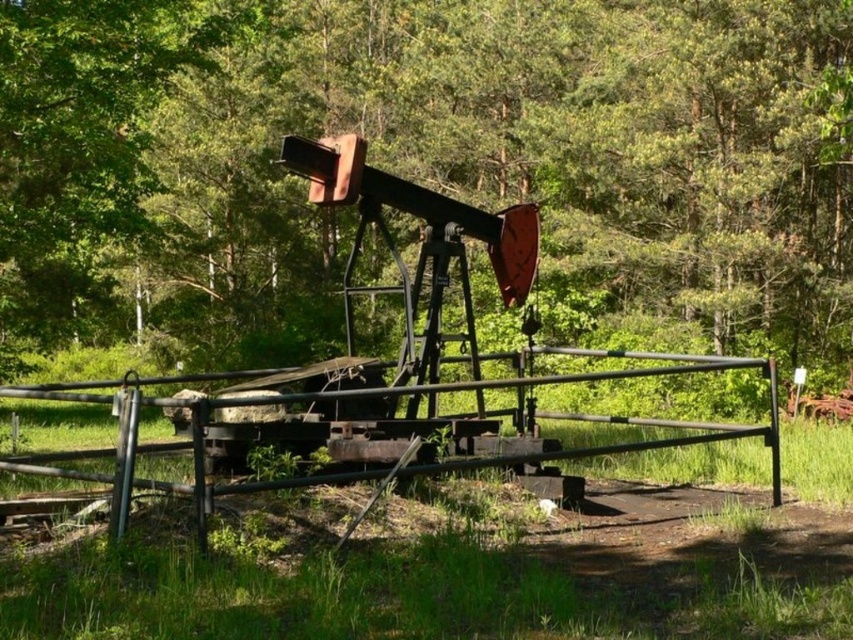
Question: From the image, what is the correct spatial relationship of green leafy tree at center in relation to rusty metal fence at center?

Choices:
 (A) left
 (B) right

Answer: (A)

Question: Does green leafy tree at center appear under rusty metal fence at center?

Choices:
 (A) no
 (B) yes

Answer: (A)

Question: Which object is farther from the camera taking this photo?

Choices:
 (A) green leafy tree at center
 (B) rusty metal fence at center

Answer: (A)

Question: Does green leafy tree at center appear on the left side of rusty metal fence at center?

Choices:
 (A) no
 (B) yes

Answer: (B)